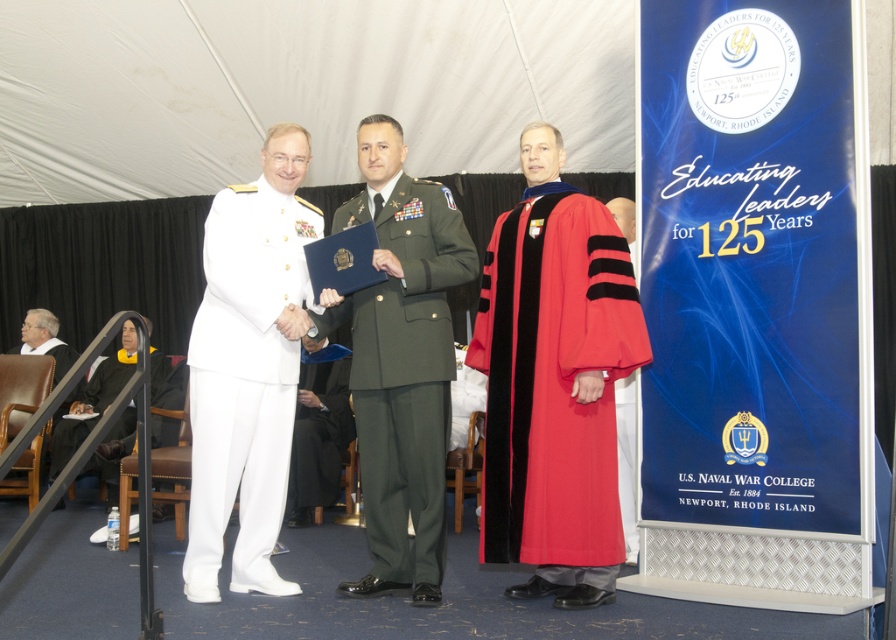
You are a photographer at the event and need to capture a photo of the green matte uniform at center and the black fabric graduation gown at lower left. Which one is positioned to the right of the other?

The green matte uniform at center is positioned on the right side of black fabric graduation gown at lower left.

You are attending the U.S. Naval War College 125th anniversary event and need to locate the velvet red graduation gown at center. Based on the coordinates provided in the scene description, can you determine its position relative to the individuals in the foreground?

The velvet red graduation gown at center is located at coordinates point (554,384), which places it centrally in the scene, likely positioned between the three individuals in the foreground.